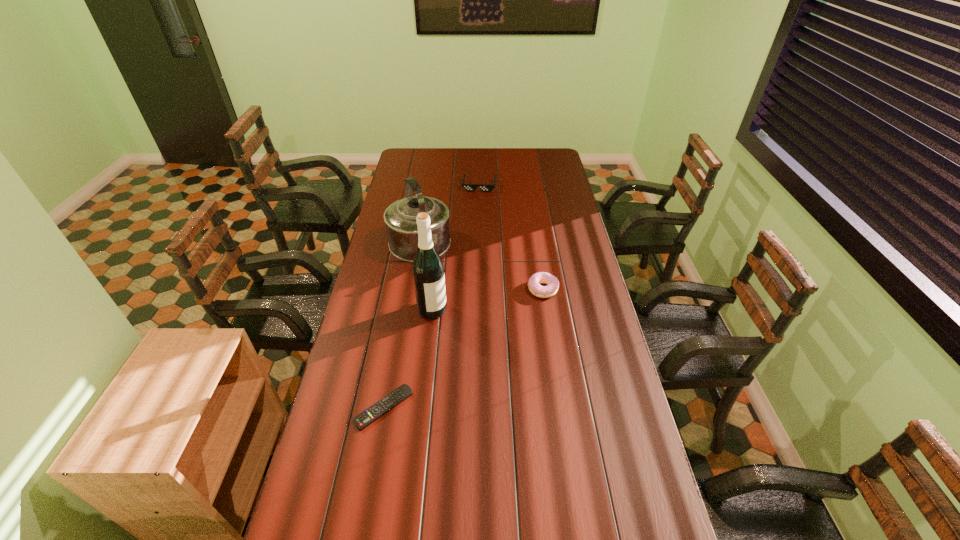
You are a GUI agent. You are given a task and a screenshot of the screen. Output one action in this format:
    pyautogui.click(x=<x>, y=<y>)
    Task: Click on the free space on the desktop that is between the shortest object and the doughnut and is positioned on the front-facing side of the fourth object from left to right
    
    Given the screenshot: What is the action you would take?
    coord(459,351)

The image size is (960, 540). Identify the location of vacant space on the desktop that is between the shortest object and the doughnut and is positioned with the spout at the front of the kettle. (474, 340).

I want to click on vacant spot on the desktop that is between the shortest object and the rightmost object and is positioned on the label of the tallest object, so click(469, 343).